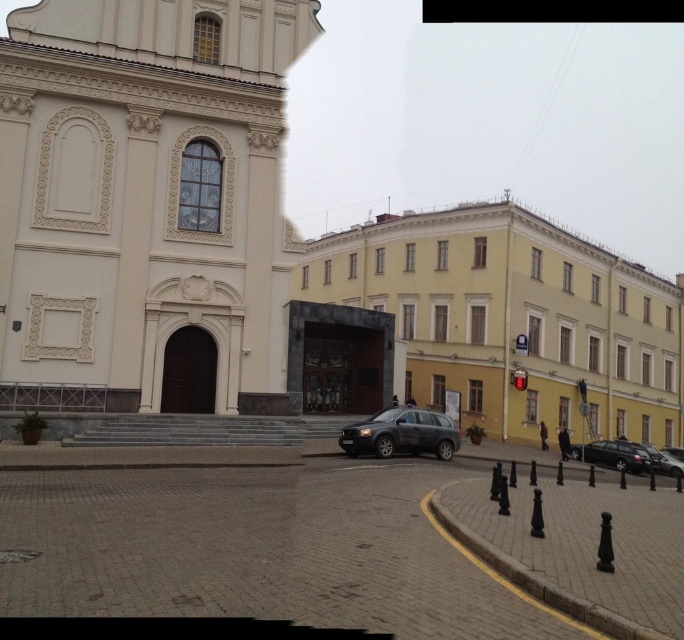
Which is more to the left, beige stone church at center or shiny black sedan at lower right?

shiny black sedan at lower right is more to the left.

In order to click on beige stone church at center in this screenshot , I will do `click(278, 250)`.

Find the location of a particular element. This screenshot has width=684, height=640. beige stone church at center is located at coordinates (278, 250).

Locate an element on the screen. beige stone church at center is located at coordinates (278, 250).

Is yellow matte building at center further to camera compared to dark gray matte suv at center?

Yes, yellow matte building at center is further from the viewer.

Is point (505, 243) positioned behind point (339, 445)?

Yes.

At what (x,y) coordinates should I click in order to perform the action: click on yellow matte building at center. Please return your answer as a coordinate pair (x, y). Image resolution: width=684 pixels, height=640 pixels. Looking at the image, I should click on (513, 320).

This screenshot has width=684, height=640. In order to click on yellow matte building at center in this screenshot , I will do `click(513, 320)`.

What do you see at coordinates (144, 204) in the screenshot? I see `white stone church at upper left` at bounding box center [144, 204].

Is point (103, 141) positioned after point (421, 422)?

Yes, it is.

The height and width of the screenshot is (640, 684). Identify the location of white stone church at upper left. (144, 204).